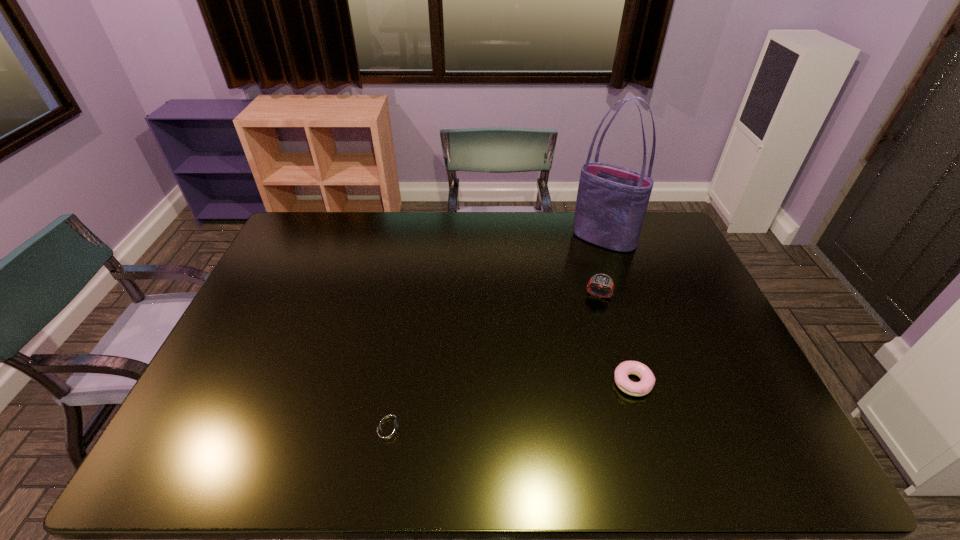
The image size is (960, 540). I want to click on vacant space at the near left corner of the desktop, so 198,464.

This screenshot has width=960, height=540. Find the location of `free space at the near right corner of the desktop`. free space at the near right corner of the desktop is located at coordinates (779, 449).

You are a GUI agent. You are given a task and a screenshot of the screen. Output one action in this format:
    pyautogui.click(x=<x>, y=<y>)
    Task: Click on the empty location between the doughnut and the second tallest object
    The image size is (960, 540).
    Given the screenshot: What is the action you would take?
    pyautogui.click(x=615, y=339)

I want to click on vacant space that is in between the leftmost object and the tallest object, so click(x=496, y=333).

In order to click on vacant space that's between the nearer watch and the second shortest object in this screenshot , I will do `click(511, 404)`.

Locate an element on the screen. The height and width of the screenshot is (540, 960). free area in between the tallest object and the second nearest object is located at coordinates (618, 310).

Identify the location of vacant space that's between the nearest object and the second farthest object. (494, 361).

At what (x,y) coordinates should I click in order to perform the action: click on free space between the third tallest object and the third shortest object. Please return your answer as a coordinate pair (x, y). Image resolution: width=960 pixels, height=540 pixels. Looking at the image, I should click on (615, 339).

Where is `free spot between the third shortest object and the farthest object`? Image resolution: width=960 pixels, height=540 pixels. free spot between the third shortest object and the farthest object is located at coordinates (601, 267).

The image size is (960, 540). I want to click on free point between the doughnut and the right watch, so click(615, 339).